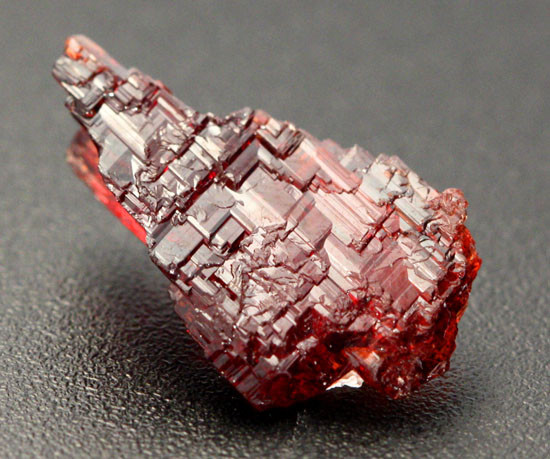
The height and width of the screenshot is (459, 550). I want to click on surface, so [107, 425].